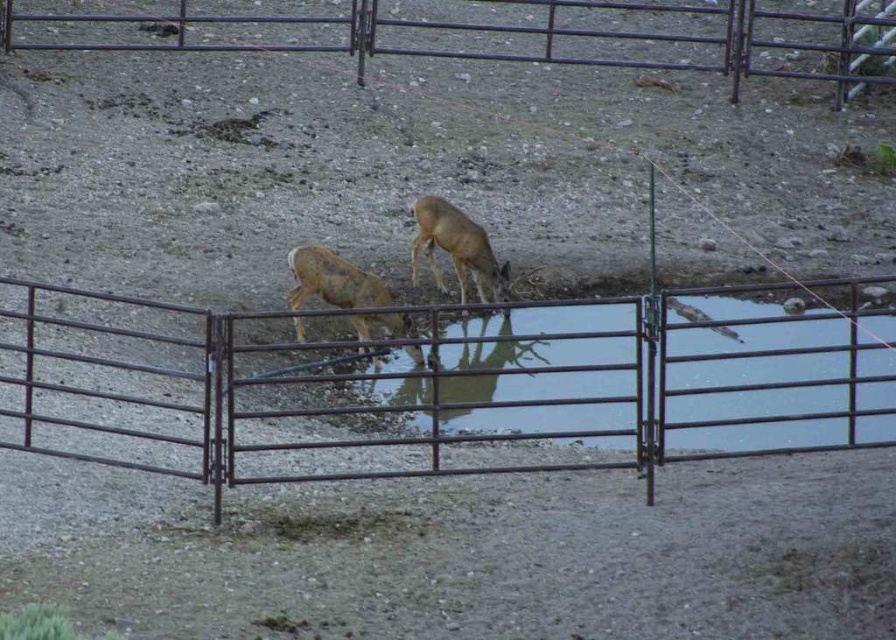
You are a park ranger standing at the entrance of the enclosure. You need to check the condition of the brushed metal fence at upper center. Given that your longest tool can reach up to 20 meters, can you safely inspect the fence without needing to move closer?

The brushed metal fence at upper center is 18.80 meters away from the viewer. Since your tool can reach up to 20 meters, you can safely inspect the fence without moving closer.